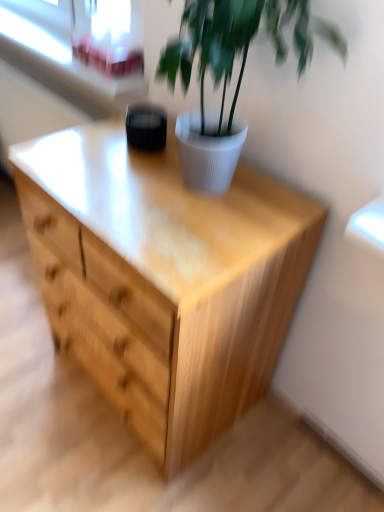
This screenshot has height=512, width=384. I want to click on free region under white ribbed pot at upper center (from a real-world perspective), so click(x=210, y=192).